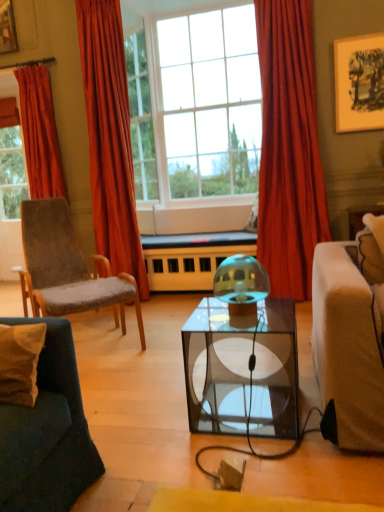
This screenshot has width=384, height=512. I want to click on red velvet curtain at left, the 3th curtain when ordered from right to left, so click(40, 133).

At what (x,y) coordinates should I click in order to perform the action: click on velvet orange curtain at left, the second curtain viewed from the left. Please return your answer as a coordinate pair (x, y). Looking at the image, I should click on (110, 138).

How much space does clear glass window at upper center, placed as the 2th window when sorted from right to left, occupy vertically?

6.49 feet.

This screenshot has width=384, height=512. What do you see at coordinates (197, 104) in the screenshot?
I see `clear glass window at center, which is counted as the first window, starting from the right` at bounding box center [197, 104].

Measure the distance between point (362, 114) and camera.

Point (362, 114) is 11.12 feet away from camera.

Measure the distance between wooden framed artwork at upper right and camera.

wooden framed artwork at upper right and camera are 10.71 feet apart from each other.

Image resolution: width=384 pixels, height=512 pixels. In order to click on velvet beige pillow at lower left in this screenshot , I will do `click(20, 362)`.

Are wooden framed artwork at upper right and red velvet curtain at left, positioned as the first curtain in left-to-right order, located far from each other?

Yes, wooden framed artwork at upper right is far from red velvet curtain at left, positioned as the first curtain in left-to-right order.

Which object is positioned more to the left, wooden framed artwork at upper right or red velvet curtain at left, the 3th curtain when ordered from right to left?

red velvet curtain at left, the 3th curtain when ordered from right to left.

In terms of height, does wooden framed artwork at upper right look taller or shorter compared to red velvet curtain at left, the 3th curtain when ordered from right to left?

Considering their sizes, wooden framed artwork at upper right has less height than red velvet curtain at left, the 3th curtain when ordered from right to left.

Is point (207, 373) farther from camera compared to point (48, 227)?

No, it is not.

Which is behind, transparent glass coffee table at center or velvet grey chair at left?

velvet grey chair at left.

Considering the relative sizes of transparent glass coffee table at center and velvet grey chair at left in the image provided, is transparent glass coffee table at center wider than velvet grey chair at left?

Incorrect, the width of transparent glass coffee table at center does not surpass that of velvet grey chair at left.

You are a GUI agent. You are given a task and a screenshot of the screen. Output one action in this format:
    pyautogui.click(x=<x>, y=<y>)
    Task: Click on the coffee table below the velvet grey chair at left (from a real-world perspective)
    The width and height of the screenshot is (384, 512).
    Given the screenshot: What is the action you would take?
    pyautogui.click(x=216, y=370)

Is velvet orange curtain at left, the second curtain viewed from the left, inside or outside of red velvet curtain at left, the 3th curtain when ordered from right to left?

velvet orange curtain at left, the second curtain viewed from the left, is not inside red velvet curtain at left, the 3th curtain when ordered from right to left, it's outside.

Considering the points (133, 272) and (45, 98), which point is in front, point (133, 272) or point (45, 98)?

The point (133, 272) is in front.

Does velvet orange curtain at left, the second curtain viewed from the left, appear on the left side of red velvet curtain at left, the 3th curtain when ordered from right to left?

No, velvet orange curtain at left, the second curtain viewed from the left, is not to the left of red velvet curtain at left, the 3th curtain when ordered from right to left.

Is there a large distance between velvet orange curtain at left, which ranks as the 2th curtain in right-to-left order, and red velvet curtain at left, the 3th curtain when ordered from right to left?

That's not correct — velvet orange curtain at left, which ranks as the 2th curtain in right-to-left order, is a little close to red velvet curtain at left, the 3th curtain when ordered from right to left.

From the picture: Is red velvet curtain at left, positioned as the first curtain in left-to-right order, in front of or behind clear glass window at upper center, which is counted as the 1th window, starting from the left, in the image?

red velvet curtain at left, positioned as the first curtain in left-to-right order, is positioned closer to the viewer than clear glass window at upper center, which is counted as the 1th window, starting from the left.

Are red velvet curtain at left, the 3th curtain when ordered from right to left, and clear glass window at upper center, which is counted as the 1th window, starting from the left, far apart?

Yes, red velvet curtain at left, the 3th curtain when ordered from right to left, and clear glass window at upper center, which is counted as the 1th window, starting from the left, are located far from each other.

Is red velvet curtain at left, positioned as the first curtain in left-to-right order, turned away from clear glass window at upper center, placed as the 2th window when sorted from right to left?

red velvet curtain at left, positioned as the first curtain in left-to-right order, is not turned away from clear glass window at upper center, placed as the 2th window when sorted from right to left.

Between red velvet curtain at left, the 3th curtain when ordered from right to left, and clear glass window at upper center, placed as the 2th window when sorted from right to left, which one has less height?

Standing shorter between the two is red velvet curtain at left, the 3th curtain when ordered from right to left.

From the picture: Is wooden framed artwork at upper right positioned with its back to velvet beige pillow at lower left?

No, wooden framed artwork at upper right is not facing away from velvet beige pillow at lower left.

In the image, there is a velvet beige pillow at lower left. What are the coordinates of `picture frame above it (from the image's perspective)` in the screenshot? It's located at (x=359, y=83).

Is wooden framed artwork at upper right taller than velvet beige pillow at lower left?

Indeed, wooden framed artwork at upper right has a greater height compared to velvet beige pillow at lower left.

From the image's perspective, is wooden framed artwork at upper right above or below velvet beige pillow at lower left?

wooden framed artwork at upper right is situated higher than velvet beige pillow at lower left in the image.

Considering their positions, is velvet grey chair at left located in front of or behind red velvet curtain at center, the third curtain in the left-to-right sequence?

In the image, velvet grey chair at left appears in front of red velvet curtain at center, the third curtain in the left-to-right sequence.

Is velvet grey chair at left next to red velvet curtain at center, which ranks as the 1th curtain in right-to-left order?

No.

Considering the sizes of objects velvet grey chair at left and red velvet curtain at center, the third curtain in the left-to-right sequence, in the image provided, who is wider, velvet grey chair at left or red velvet curtain at center, the third curtain in the left-to-right sequence,?

velvet grey chair at left is wider.

From the image's perspective, does velvet grey chair at left appear lower than red velvet curtain at center, which ranks as the 1th curtain in right-to-left order?

Yes, from the image's perspective, velvet grey chair at left is beneath red velvet curtain at center, which ranks as the 1th curtain in right-to-left order.

Is point (217, 127) closer or farther from the camera than point (152, 170)?

Clearly, point (217, 127) is closer to the camera than point (152, 170).

From a real-world perspective, is clear glass window at center, marked as the second window in a left-to-right arrangement, above or below clear glass window at upper center, which is counted as the 1th window, starting from the left?

From a real-world perspective, clear glass window at center, marked as the second window in a left-to-right arrangement, is physically below clear glass window at upper center, which is counted as the 1th window, starting from the left.

In the scene shown: Considering the relative sizes of clear glass window at center, marked as the second window in a left-to-right arrangement, and clear glass window at upper center, placed as the 2th window when sorted from right to left, in the image provided, is clear glass window at center, marked as the second window in a left-to-right arrangement, thinner than clear glass window at upper center, placed as the 2th window when sorted from right to left,?

Incorrect, the width of clear glass window at center, marked as the second window in a left-to-right arrangement, is not less than that of clear glass window at upper center, placed as the 2th window when sorted from right to left.

Which of these two, clear glass window at center, marked as the second window in a left-to-right arrangement, or clear glass window at upper center, which is counted as the 1th window, starting from the left, is bigger?

clear glass window at center, marked as the second window in a left-to-right arrangement, is bigger.

Where is `the 1st curtain below the wooden framed artwork at upper right (from the image's perspective)`? the 1st curtain below the wooden framed artwork at upper right (from the image's perspective) is located at coordinates (40, 133).

Locate an element on the screen. The width and height of the screenshot is (384, 512). coffee table in front of the velvet grey chair at left is located at coordinates 216,370.

In the scene shown: Based on their spatial positions, is wooden framed artwork at upper right or velvet beige pillow at lower left closer to clear glass window at upper center, placed as the 2th window when sorted from right to left?

wooden framed artwork at upper right is closer to clear glass window at upper center, placed as the 2th window when sorted from right to left.

Considering their positions, is velvet grey chair at left positioned further to wooden framed artwork at upper right than velvet beige pillow at lower left?

The object further to wooden framed artwork at upper right is velvet beige pillow at lower left.

Considering their positions, is clear glass window at center, marked as the second window in a left-to-right arrangement, positioned closer to velvet orange curtain at left, which ranks as the 2th curtain in right-to-left order, than velvet beige pillow at lower left?

clear glass window at center, marked as the second window in a left-to-right arrangement, is positioned closer to the anchor velvet orange curtain at left, which ranks as the 2th curtain in right-to-left order.

Estimate the real-world distances between objects in this image. Which object is further from clear glass window at upper center, placed as the 2th window when sorted from right to left, wooden framed artwork at upper right or red velvet curtain at left, positioned as the first curtain in left-to-right order?

wooden framed artwork at upper right.

From the image, which object appears to be nearer to red velvet curtain at left, positioned as the first curtain in left-to-right order, transparent glass coffee table at center or wooden framed artwork at upper right?

transparent glass coffee table at center lies closer to red velvet curtain at left, positioned as the first curtain in left-to-right order, than the other object.

Estimate the real-world distances between objects in this image. Which object is closer to clear glass window at upper center, which is counted as the 1th window, starting from the left, red velvet curtain at left, positioned as the first curtain in left-to-right order, or wooden framed artwork at upper right?

The object closer to clear glass window at upper center, which is counted as the 1th window, starting from the left, is red velvet curtain at left, positioned as the first curtain in left-to-right order.

Which object lies nearer to the anchor point transparent glass coffee table at center, velvet orange curtain at left, the second curtain viewed from the left, or red velvet curtain at left, positioned as the first curtain in left-to-right order?

velvet orange curtain at left, the second curtain viewed from the left.

Which object lies further to the anchor point transparent glass coffee table at center, red velvet curtain at center, the third curtain in the left-to-right sequence, or velvet grey chair at left?

Among the two, red velvet curtain at center, the third curtain in the left-to-right sequence, is located further to transparent glass coffee table at center.

Image resolution: width=384 pixels, height=512 pixels. I want to click on chair between velvet beige pillow at lower left and clear glass window at center, marked as the second window in a left-to-right arrangement, along the z-axis, so click(x=67, y=268).

At what (x,y) coordinates should I click in order to perform the action: click on pillow located between velvet orange curtain at left, which ranks as the 2th curtain in right-to-left order, and wooden framed artwork at upper right in the left-right direction. Please return your answer as a coordinate pair (x, y). Looking at the image, I should click on (20, 362).

Where is `coffee table positioned between velvet beige pillow at lower left and velvet grey chair at left from near to far`? This screenshot has height=512, width=384. coffee table positioned between velvet beige pillow at lower left and velvet grey chair at left from near to far is located at coordinates (216, 370).

Locate an element on the screen. The width and height of the screenshot is (384, 512). curtain between velvet orange curtain at left, the second curtain viewed from the left, and wooden framed artwork at upper right is located at coordinates (289, 148).